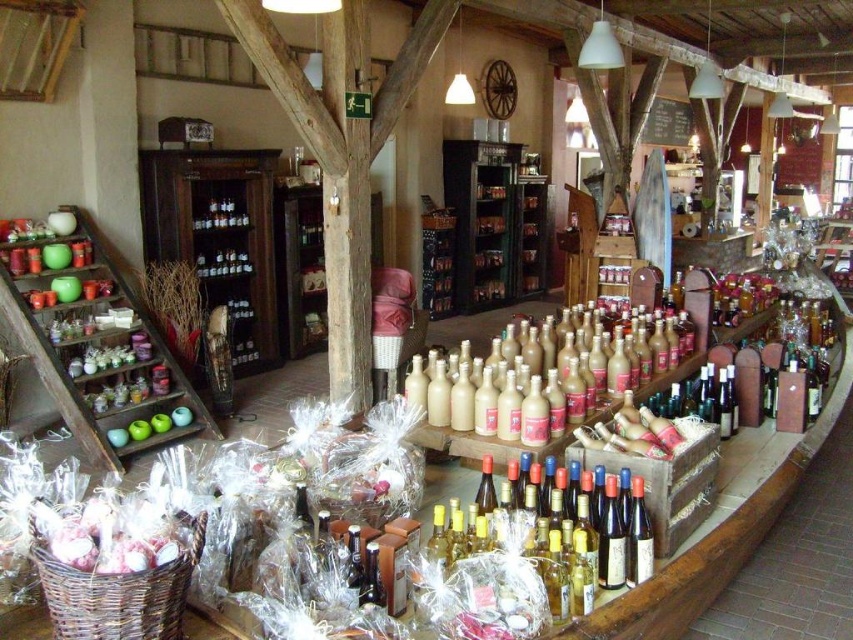
Question: Does wooden shelves at left appear over white paper wrapped at lower left?

Choices:
 (A) yes
 (B) no

Answer: (A)

Question: Which point is farther to the camera?

Choices:
 (A) (541, 604)
 (B) (257, 310)

Answer: (B)

Question: Is the position of wooden shelves at left more distant than that of matte brown glass bottles at center?

Choices:
 (A) no
 (B) yes

Answer: (B)

Question: Which of the following is the farthest from the observer?

Choices:
 (A) clear glass bottles at center
 (B) wooden cabinet at center

Answer: (A)

Question: Which point is farther from the camera taking this photo?

Choices:
 (A) (206, 228)
 (B) (134, 518)
 (C) (473, 337)
 (D) (170, 410)

Answer: (C)

Question: Does wooden shelves at left lie behind matte brown glass bottles at center?

Choices:
 (A) no
 (B) yes

Answer: (B)